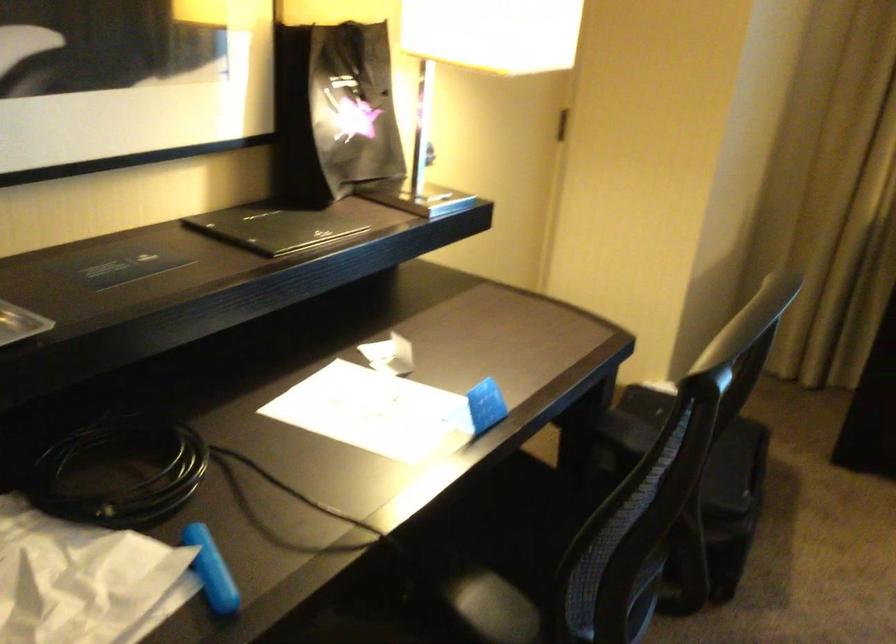
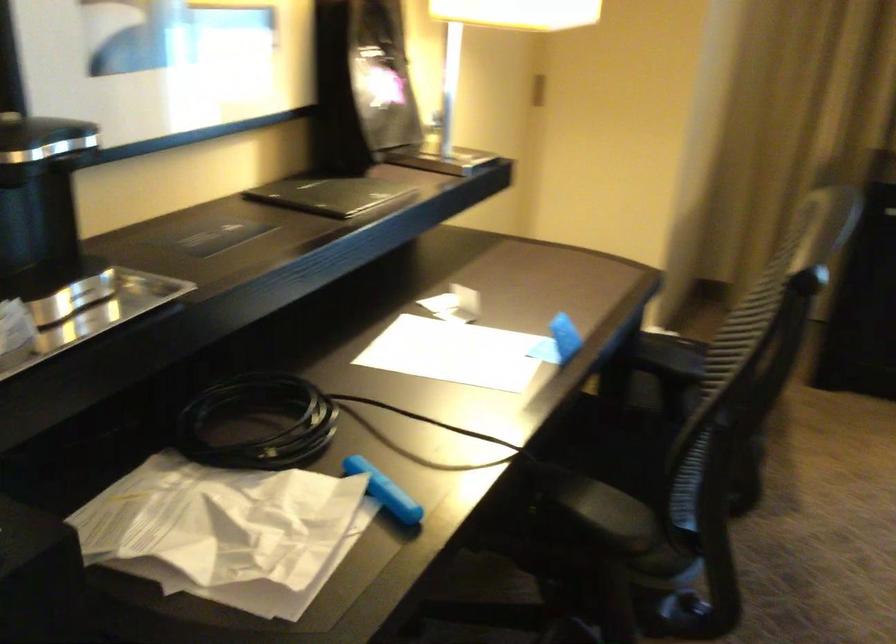
Question: The first image is from the beginning of the video and the second image is from the end. How did the camera likely rotate when shooting the video?

Choices:
 (A) Left
 (B) Right
 (C) Up
 (D) Down

Answer: (B)